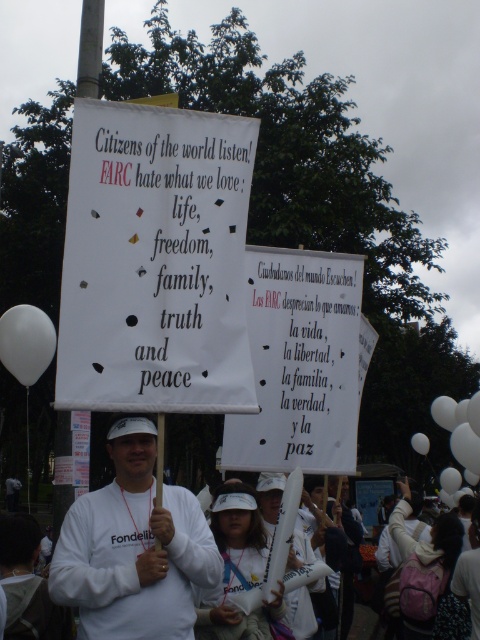
You are a photographer trying to capture the protest scene. You notice the white matte shirt at center and the white balloon at center. Which object is closer to the camera?

The white matte shirt at center is positioned over the white balloon at center, meaning it is closer to the camera.

You are a photographer at the protest scene. You need to capture a photo where both the white matte balloon at lower left and the white balloon at center are visible. Which balloon should you zoom in on to ensure both are in frame without moving the camera?

You should zoom in on the white balloon at center because it is wider than the white matte balloon at lower left, allowing both to fit within the camera frame when focusing on the larger one.